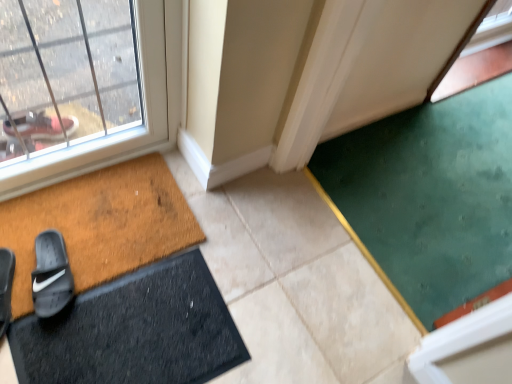
Where is `free spot to the right of black rubber slide at lower left, which is the second footwear in left-to-right order`? This screenshot has width=512, height=384. free spot to the right of black rubber slide at lower left, which is the second footwear in left-to-right order is located at coordinates (106, 263).